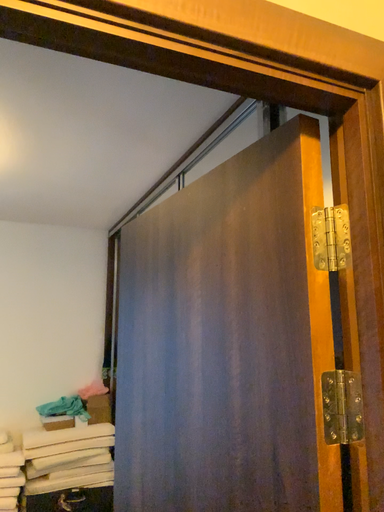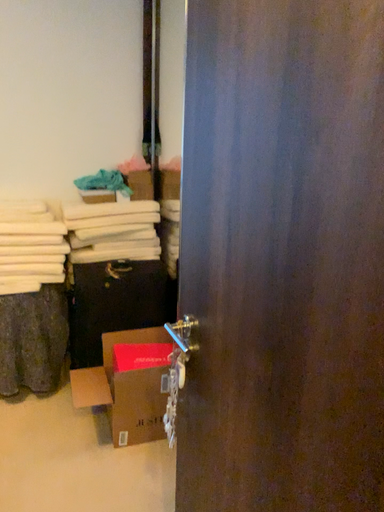
Question: Which way did the camera rotate in the video?

Choices:
 (A) rotated downward
 (B) rotated upward

Answer: (A)